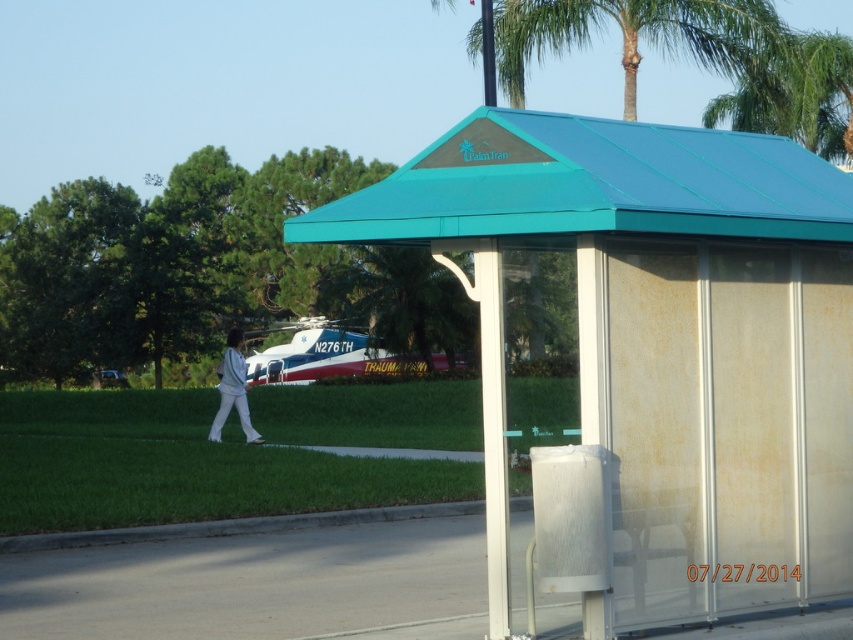
Is teal plastic bus stop at center smaller than teal metal roof at upper center?

No.

Can you confirm if teal plastic bus stop at center is bigger than teal metal roof at upper center?

Yes.

The width and height of the screenshot is (853, 640). Describe the element at coordinates (642, 360) in the screenshot. I see `teal plastic bus stop at center` at that location.

This screenshot has width=853, height=640. Identify the location of teal plastic bus stop at center. (642, 360).

Which is above, green leafy palm tree at upper center or green leafy palm tree at center?

Positioned higher is green leafy palm tree at upper center.

Measure the distance between point (631, 97) and camera.

They are 39.67 meters apart.

Where is `green leafy palm tree at upper center`? green leafy palm tree at upper center is located at coordinates (634, 35).

Which of these two, teal plastic bus stop at center or green leafy palm tree at center, stands taller?

teal plastic bus stop at center is taller.

Locate an element on the screen. The image size is (853, 640). teal plastic bus stop at center is located at coordinates (642, 360).

Between point (540, 148) and point (450, 282), which one is positioned behind?

Point (450, 282)

Locate an element on the screen. teal plastic bus stop at center is located at coordinates (642, 360).